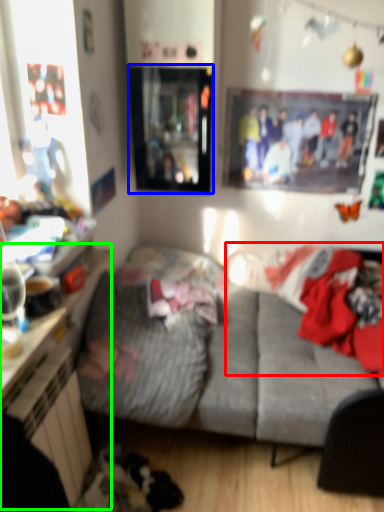
Question: Estimate the real-world distances between objects in this image. Which object is farther from laundry (highlighted by a red box), window screen (highlighted by a blue box) or dresser (highlighted by a green box)?

Choices:
 (A) window screen
 (B) dresser

Answer: (B)